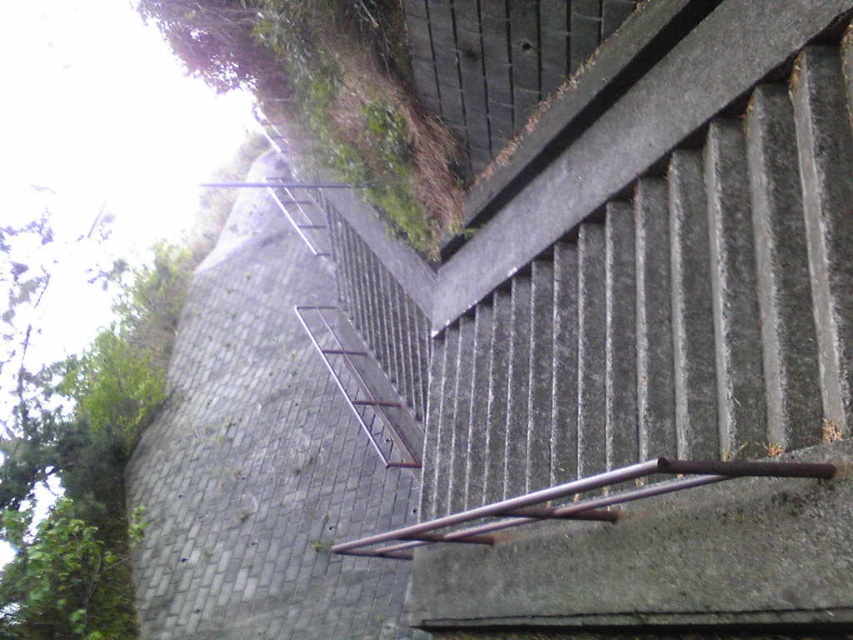
Question: Is gray concrete wall at upper left thinner than rusty metal rail at center?

Choices:
 (A) no
 (B) yes

Answer: (B)

Question: Is gray concrete wall at upper left further to the viewer compared to rusty metal rail at center?

Choices:
 (A) no
 (B) yes

Answer: (B)

Question: Among these objects, which one is nearest to the camera?

Choices:
 (A) rusty metal rail at center
 (B) gray concrete wall at upper left

Answer: (A)

Question: Is gray concrete wall at upper left positioned at the back of rusty metal rail at center?

Choices:
 (A) no
 (B) yes

Answer: (B)

Question: Which point appears farthest from the camera in this image?

Choices:
 (A) (515, 497)
 (B) (375, 468)

Answer: (B)